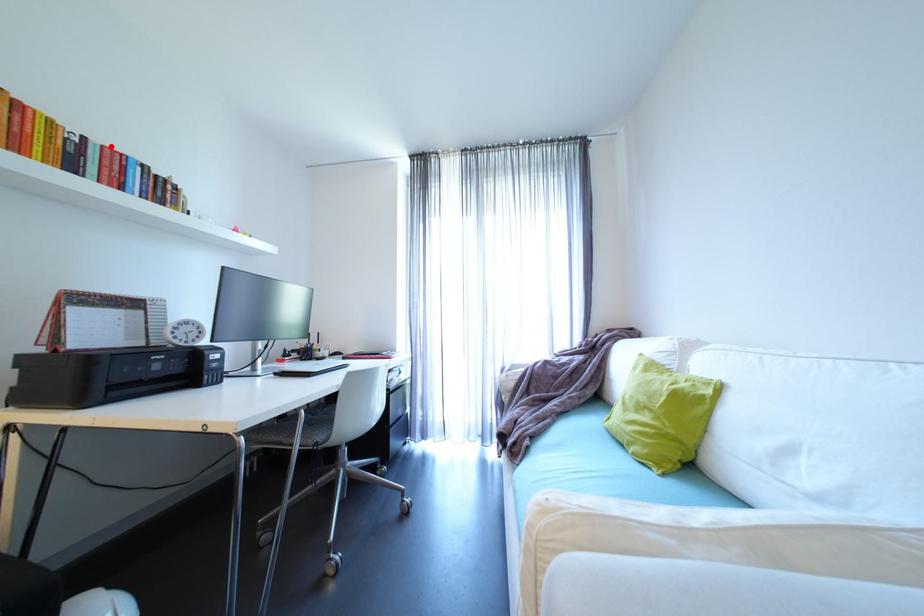
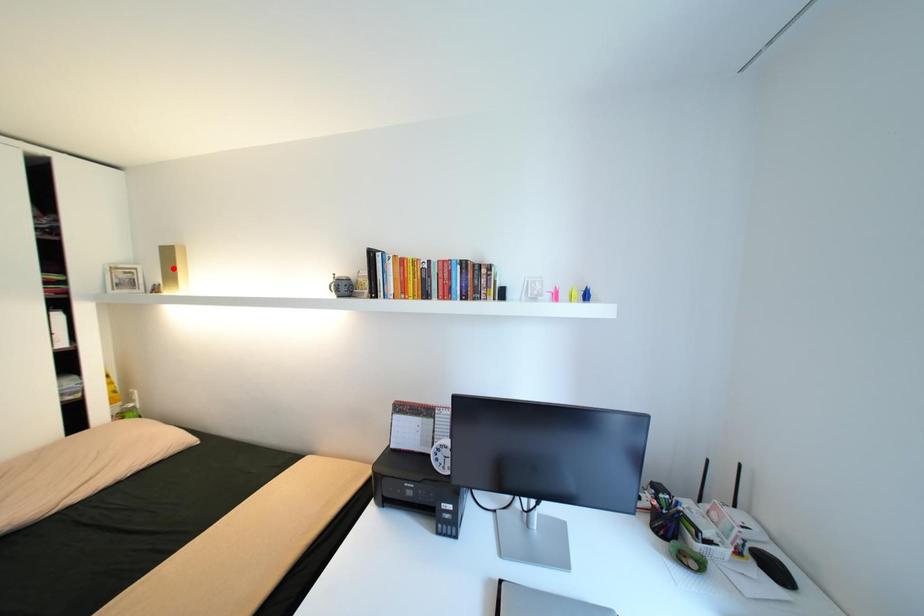
I am providing you with two images of the same scene from different viewpoints. A red point is marked on the first image and another point is marked on the second image. Are the points marked in image1 and image2 representing the same 3D position?

No